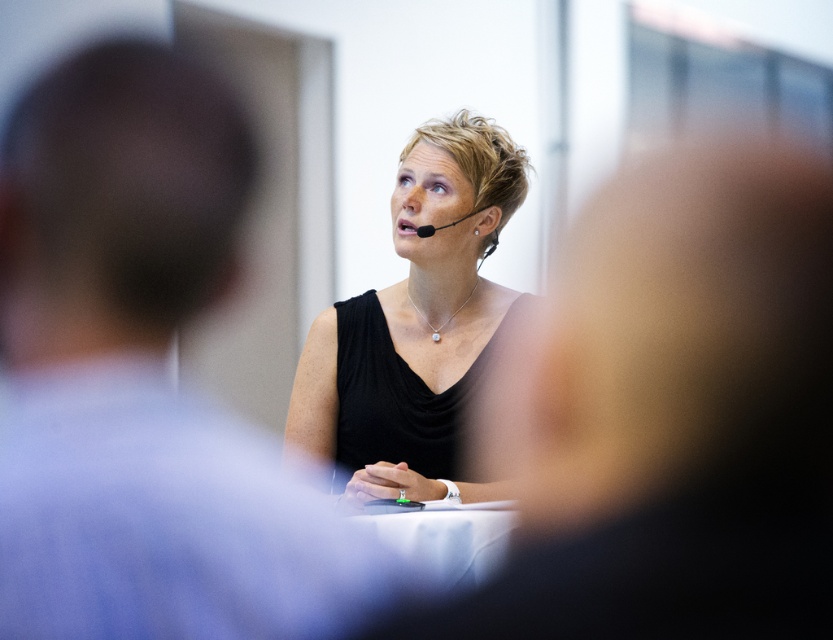
You are trying to locate the point at coordinates [416,324] in the image. Based on the description, where would this point be located?

The point at coordinates [416,324] is located on the black matte dress at center.

You are organizing a photography session and need to ensure that both the black matte dress at center and the matte black face at center are clearly visible in the frame. Given their sizes, which object should you focus on to ensure it stands out more due to its size?

The black matte dress at center is larger in size than the matte black face at center, so focusing on the black matte dress at center will ensure it stands out more due to its size.